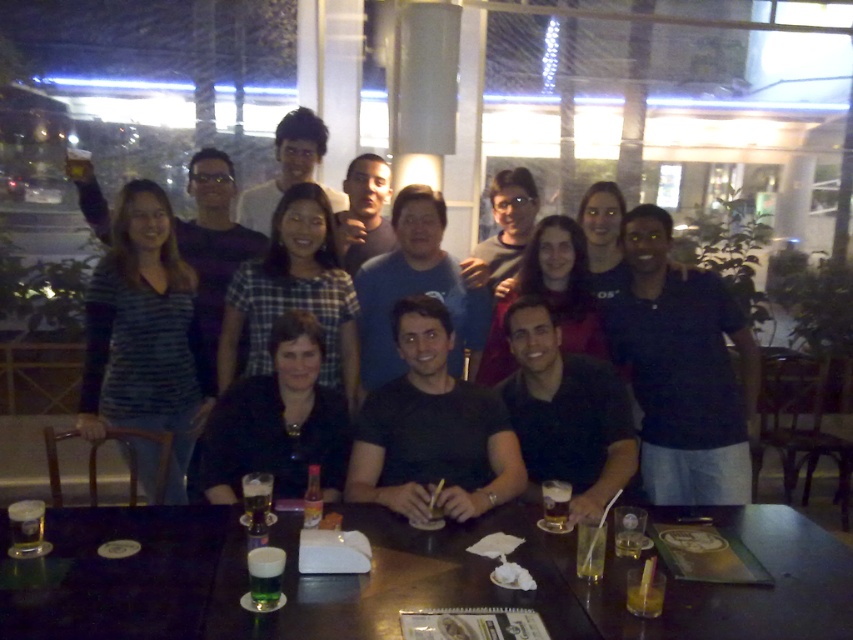
You are a photographer at the event and want to place a new item on the table so that it is directly in front of the green matte glass at center. Where should you place the new item?

You should place the new item at point (265, 577) to be directly in front of the green matte glass at center.

You are a photographer standing at a certain distance from the group. You want to take a clear photo of the smooth black shirt at center without any blur. Considering the camera requires a minimum distance of 2 meters to avoid motion blur, will you need to move closer or farther away?

The distance between the smooth black shirt at center and the camera is 1.89 meters, which is less than the required 2 meters. Therefore, you should move farther away to avoid motion blur.